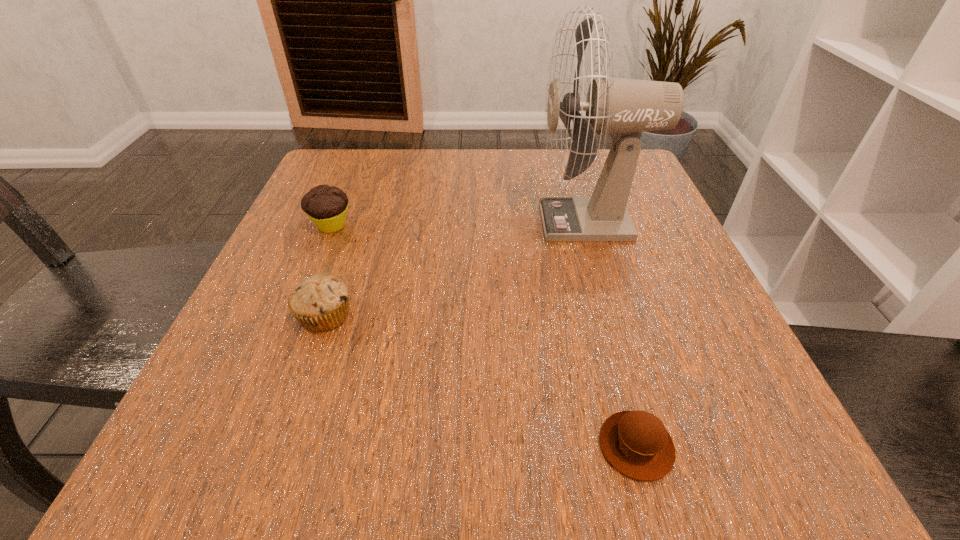
I want to click on the tallest object, so click(625, 107).

Find the location of a particular element. the farthest muffin is located at coordinates 326,206.

Where is `the third farthest object`? This screenshot has height=540, width=960. the third farthest object is located at coordinates (320, 302).

This screenshot has width=960, height=540. Find the location of `the rightmost muffin`. the rightmost muffin is located at coordinates (636, 443).

Find the location of a particular element. the shortest muffin is located at coordinates (636, 443).

Identify the location of free space located 0.230m on the air flow direction of the fan. (422, 221).

This screenshot has width=960, height=540. In order to click on free space located on the air flow direction of the fan in this screenshot , I will do `click(448, 221)`.

Identify the location of blank space located on the air flow direction of the fan. (x=408, y=221).

You are a GUI agent. You are given a task and a screenshot of the screen. Output one action in this format:
    pyautogui.click(x=<x>, y=<y>)
    Task: Click on the vacant space located 0.390m on the right of the farthest muffin
    
    Given the screenshot: What is the action you would take?
    pyautogui.click(x=551, y=226)

Locate an element on the screen. free space located 0.250m on the right of the third farthest object is located at coordinates (514, 315).